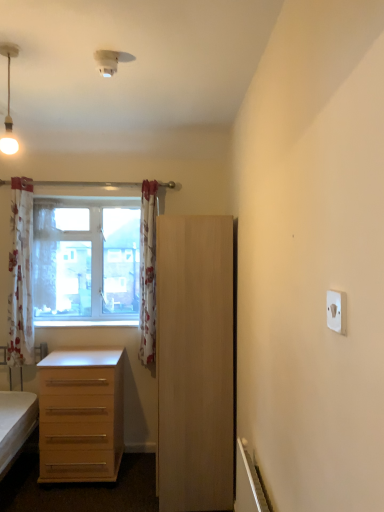
Where is `vacant region to the right of light wood drawer at lower left`? Image resolution: width=384 pixels, height=512 pixels. vacant region to the right of light wood drawer at lower left is located at coordinates (134, 475).